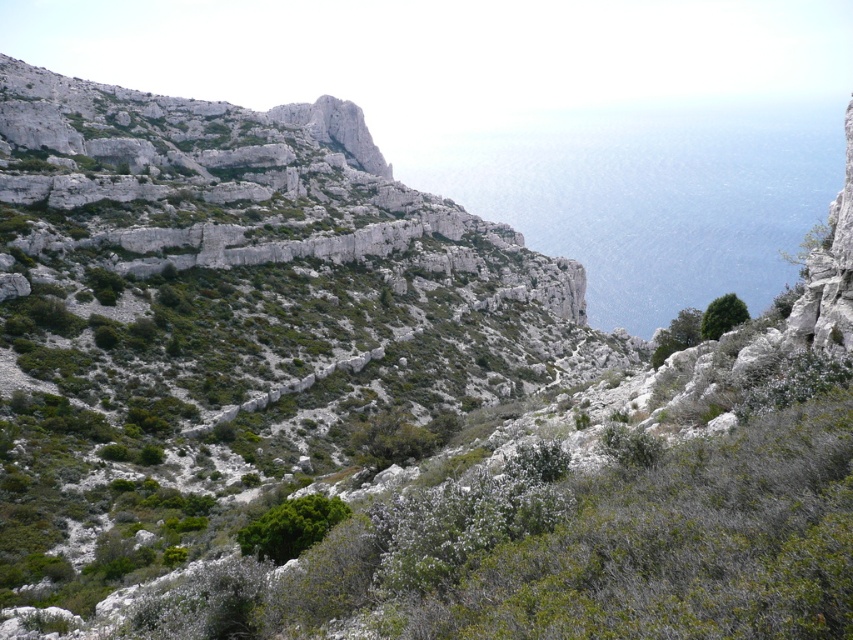
You are a hiker trying to navigate the rocky terrain. You see two green leafy bushes. Which one is closer to you, the green leafy bush at center or the green leafy bush at upper right?

The green leafy bush at center is closer to you because it is in front of the green leafy bush at upper right.

You are standing at the top of the rocky slope and see the green leafy bush at center. If you want to reach it, in which direction should you move?

You should move downward towards the green leafy bush at center located at point (291,525) since it is positioned lower on the slope than your current position at the top.

You are a hiker navigating the rocky terrain and want to move from the green leafy bush at center to the green leafy bush at upper right. Which direction should you move to reach your destination?

To move from the green leafy bush at center to the green leafy bush at upper right, you should move to the right since the green leafy bush at upper right is located to the right of the green leafy bush at center.